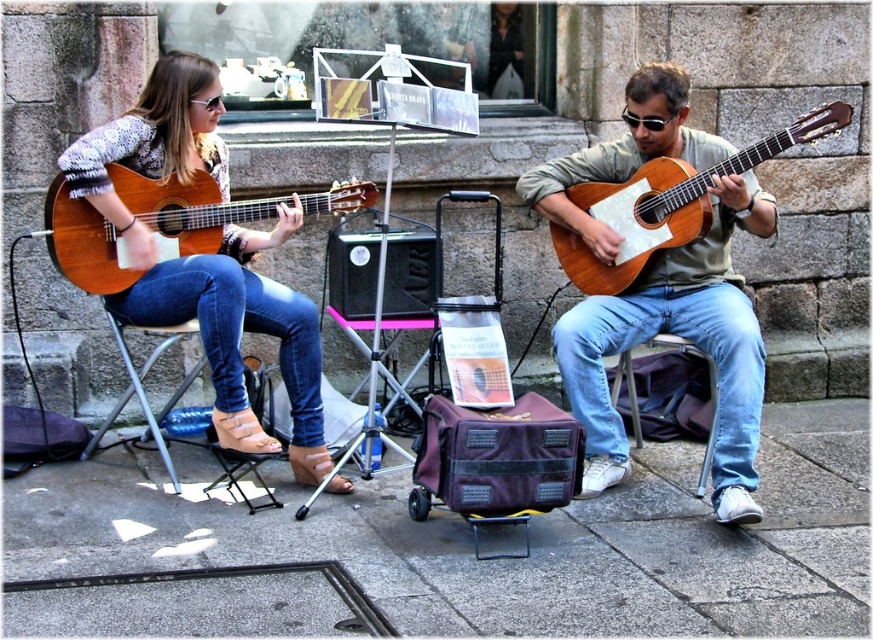
Based on the photo, you are a photographer trying to capture a closeup of the musician on the right. You are standing directly in front of the camera, which is positioned at the origin point. There are two points marked on the scene. Point A is at coordinates point (65, 492) and Point B is at coordinates point (200, 362). Which point should you focus on to get the closest possible shot of the musician on the right?

Point A at coordinates point (65, 492) is closer to the camera than point B at coordinates point (200, 362), so focusing on Point A will provide the closest shot of the musician on the right.

You are a photographer wanting to capture a wide shot of the scene. The smooth concrete pavement at center and the metallic silver chair at lower left are in your frame. Which object takes up more space in the photo?

The smooth concrete pavement at center takes up more space in the photo because it is bigger than the metallic silver chair at lower left.

You are a photographer standing in front of the musicians. You want to take a photo that clearly shows both the matte black guitar at left and the metallic silver chair at lower left. Which object should you focus on first to ensure both are in sharp focus?

You should focus on the matte black guitar at left first because it is closer to the viewer than the metallic silver chair at lower left. By focusing on the closer object, the farther object will also be in focus due to the depth of field.